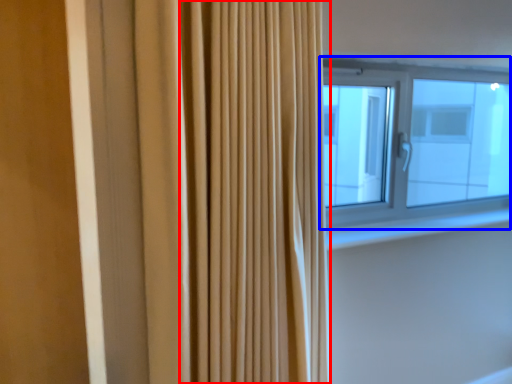
Question: Which of the following is the closest to the observer, shower curtain (highlighted by a red box) or window (highlighted by a blue box)?

Choices:
 (A) shower curtain
 (B) window

Answer: (A)